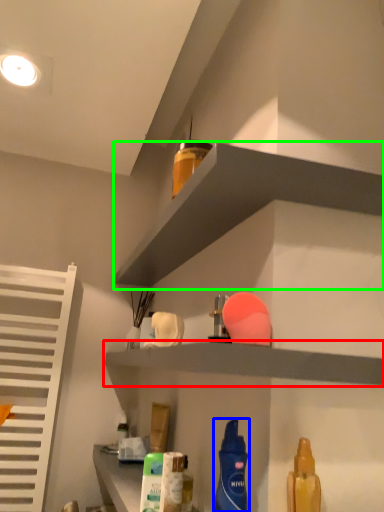
Question: Estimate the real-world distances between objects in this image. Which object is farther from shelf (highlighted by a red box), cleaning product (highlighted by a blue box) or shelf (highlighted by a green box)?

Choices:
 (A) cleaning product
 (B) shelf

Answer: (B)